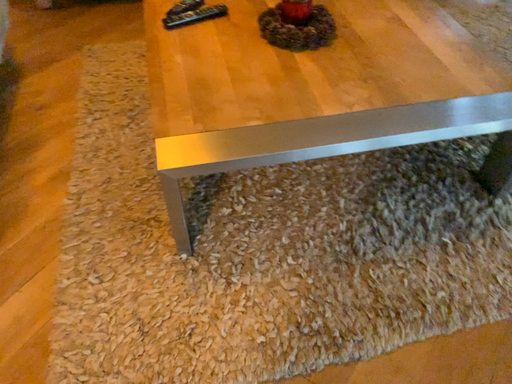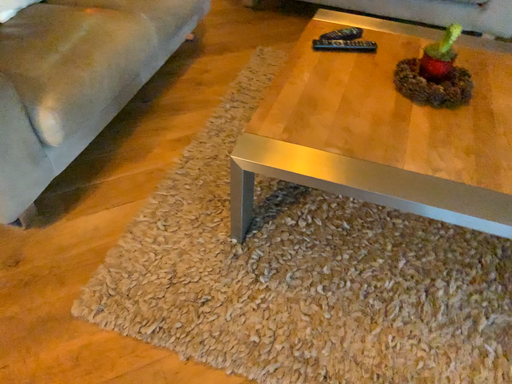
Question: How did the camera likely rotate when shooting the video?

Choices:
 (A) rotated downward
 (B) rotated upward

Answer: (B)